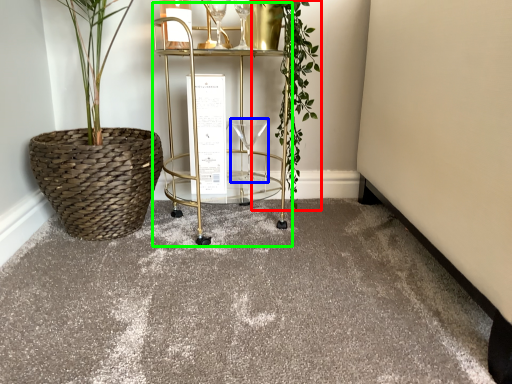
Question: Estimate the real-world distances between objects in this image. Which object is closer to vegetation (highlighted by a red box), wine glass (highlighted by a blue box) or cart (highlighted by a green box)?

Choices:
 (A) wine glass
 (B) cart

Answer: (B)